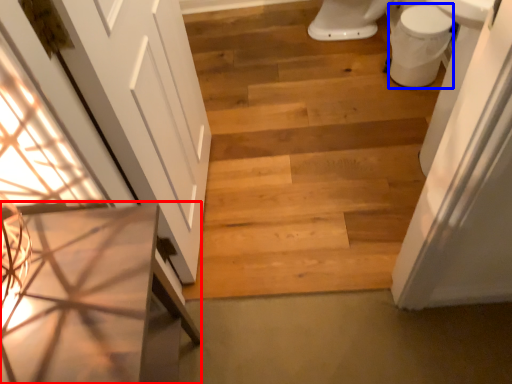
Question: Which of the following is the closest to the observer, vanity (highlighted by a red box) or toilet bowl (highlighted by a blue box)?

Choices:
 (A) vanity
 (B) toilet bowl

Answer: (A)